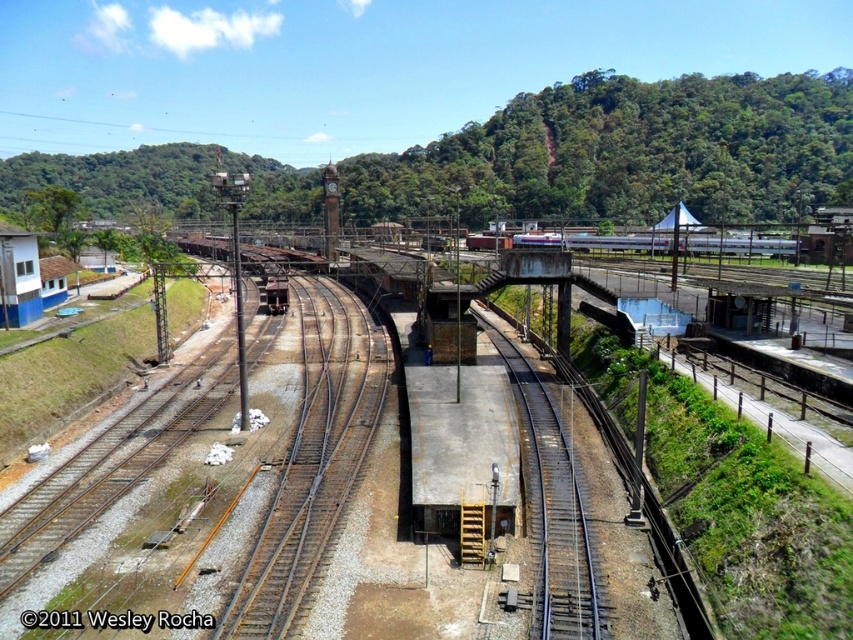
Question: Which object appears closest to the camera in this image?

Choices:
 (A) green leafy hillside at upper center
 (B) silver metallic train at center
 (C) smooth steel tracks at center

Answer: (C)

Question: Is green leafy hillside at upper center closer to camera compared to smooth steel tracks at center?

Choices:
 (A) yes
 (B) no

Answer: (B)

Question: Among these objects, which one is nearest to the camera?

Choices:
 (A) green leafy hillside at upper center
 (B) silver metallic train at center
 (C) smooth steel tracks at center

Answer: (C)

Question: Which of the following is the farthest from the observer?

Choices:
 (A) silver metallic train at center
 (B) green leafy hillside at upper center
 (C) smooth steel tracks at center

Answer: (B)

Question: Is smooth steel tracks at center smaller than silver metallic train at center?

Choices:
 (A) no
 (B) yes

Answer: (B)

Question: Is green leafy hillside at upper center to the left of smooth steel tracks at center from the viewer's perspective?

Choices:
 (A) no
 (B) yes

Answer: (B)